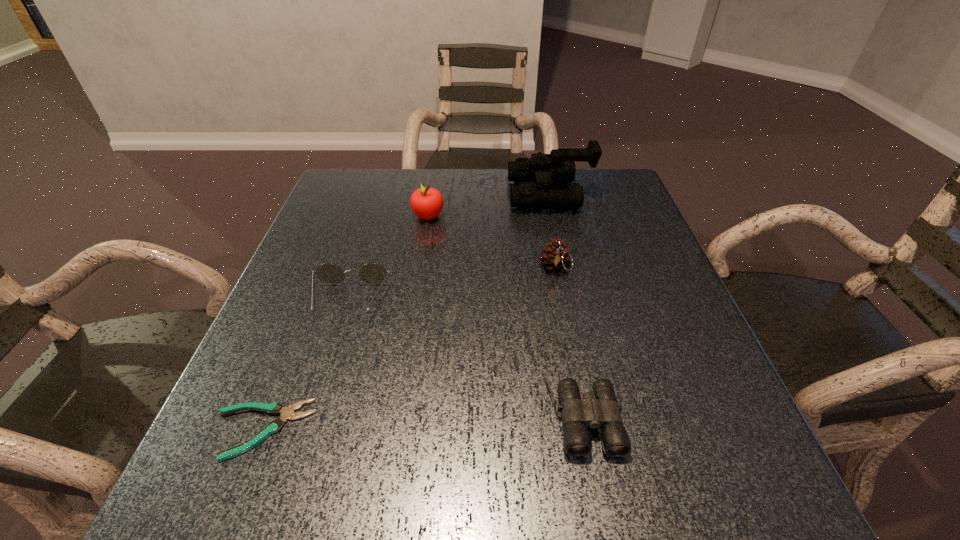
You are a GUI agent. You are given a task and a screenshot of the screen. Output one action in this format:
    pyautogui.click(x=<x>, y=<y>)
    Task: Click on the pliers
    This screenshot has height=540, width=960.
    Given the screenshot: What is the action you would take?
    pyautogui.click(x=275, y=408)

The height and width of the screenshot is (540, 960). I want to click on free space located 0.290m on the front lenses of the tallest object, so 404,194.

At what (x,y) coordinates should I click in order to perform the action: click on vacant space situated on the front lenses of the tallest object. Please return your answer as a coordinate pair (x, y). Looking at the image, I should click on (492, 194).

The height and width of the screenshot is (540, 960). I want to click on free region located 0.350m on the front lenses of the tallest object, so click(383, 194).

You are a GUI agent. You are given a task and a screenshot of the screen. Output one action in this format:
    pyautogui.click(x=<x>, y=<y>)
    Task: Click on the free location located 0.070m on the left of the apple
    This screenshot has height=540, width=960.
    Given the screenshot: What is the action you would take?
    pyautogui.click(x=385, y=216)

Locate an element on the screen. The image size is (960, 540). free space located with a leaf charm attached to the pinecone is located at coordinates (584, 419).

At what (x,y) coordinates should I click in order to perform the action: click on vacant space situated on the front-facing side of the fourth tallest object. Please return your answer as a coordinate pair (x, y). Looking at the image, I should click on (281, 522).

Where is `free space located at the eyepiece of the fifth tallest object`? This screenshot has height=540, width=960. free space located at the eyepiece of the fifth tallest object is located at coordinates (598, 492).

At what (x,y) coordinates should I click in order to perform the action: click on vacant space situated on the right of the shortest object. Please return your answer as a coordinate pair (x, y). Looking at the image, I should click on (406, 430).

Locate an element on the screen. This screenshot has height=540, width=960. binoculars at the far edge is located at coordinates (559, 166).